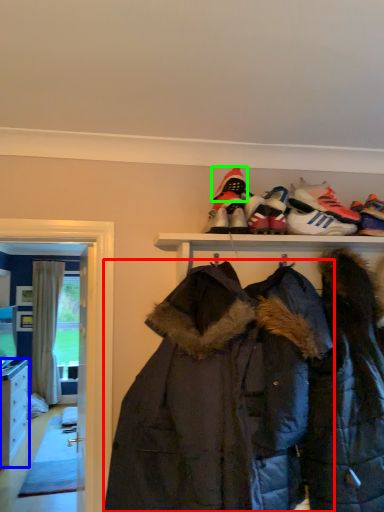
Question: Based on their relative distances, which object is farther from jacket (highlighted by a red box)? Choose from cabinetry (highlighted by a blue box) and footwear (highlighted by a green box).

Choices:
 (A) cabinetry
 (B) footwear

Answer: (A)